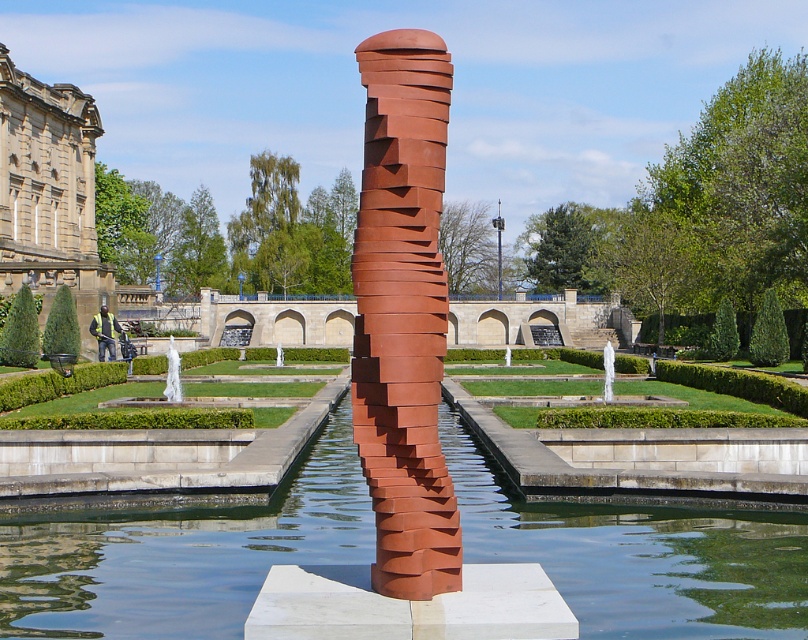
Question: Which point is closer to the camera taking this photo?

Choices:
 (A) (99, 376)
 (B) (607, 353)

Answer: (B)

Question: Does green grass at center appear on the left side of white glossy statue at center?

Choices:
 (A) yes
 (B) no

Answer: (A)

Question: Is rusty metal column at center in front of stone building at left?

Choices:
 (A) no
 (B) yes

Answer: (B)

Question: Can you confirm if rusty metal column at center is positioned above yellow reflective vest at center?

Choices:
 (A) yes
 (B) no

Answer: (B)

Question: Which object is farther from the camera taking this photo?

Choices:
 (A) white glossy statue at center
 (B) stone building at left
 (C) clear water at center

Answer: (B)

Question: Which of the following is the farthest from the observer?

Choices:
 (A) white glossy statue at center
 (B) green grass at center
 (C) white marble fountain at center

Answer: (A)